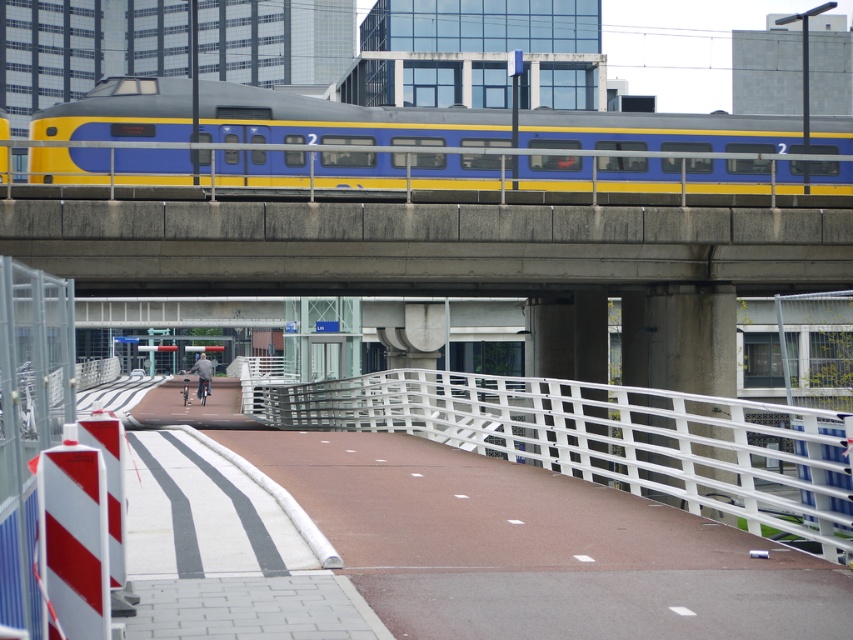
Question: Does yellow-blue painted train at upper center have a larger size compared to white metallic rail at center?

Choices:
 (A) yes
 (B) no

Answer: (B)

Question: Is yellow-blue painted train at upper center to the right of white metallic rail at center from the viewer's perspective?

Choices:
 (A) no
 (B) yes

Answer: (A)

Question: Does yellow-blue painted train at upper center appear on the left side of white metallic rail at center?

Choices:
 (A) no
 (B) yes

Answer: (B)

Question: Which of the following is the closest to the observer?

Choices:
 (A) white metallic rail at center
 (B) yellow-blue painted train at upper center

Answer: (A)

Question: Which object appears farthest from the camera in this image?

Choices:
 (A) white metallic rail at center
 (B) yellow-blue painted train at upper center

Answer: (B)

Question: Which point appears closest to the camera in this image?

Choices:
 (A) (329, 388)
 (B) (135, 122)

Answer: (B)